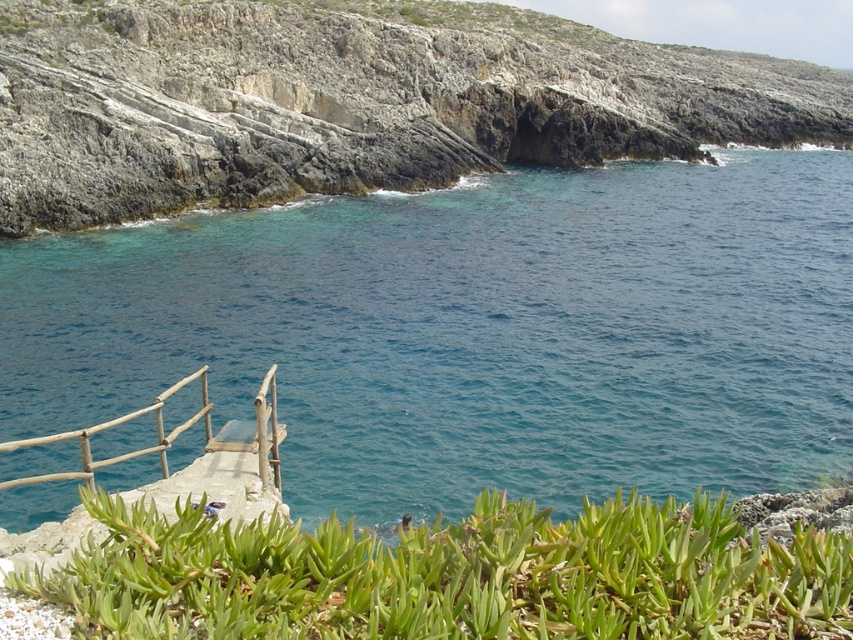
Does point (3, 138) come closer to viewer compared to point (39, 444)?

No, (3, 138) is further to viewer.

Who is positioned more to the right, rugged stone cliff at upper center or wooden rail at lower left?

rugged stone cliff at upper center is more to the right.

The image size is (853, 640). What do you see at coordinates (352, 100) in the screenshot?
I see `rugged stone cliff at upper center` at bounding box center [352, 100].

At what (x,y) coordinates should I click in order to perform the action: click on rugged stone cliff at upper center. Please return your answer as a coordinate pair (x, y). This screenshot has height=640, width=853. Looking at the image, I should click on (352, 100).

Does rugged stone cliff at upper center appear on the left side of green succulent at lower center?

In fact, rugged stone cliff at upper center is to the right of green succulent at lower center.

Between point (556, 54) and point (436, 627), which one is positioned behind?

The point (556, 54) is behind.

Who is more distant from viewer, (202, 68) or (648, 556)?

Point (202, 68)

Locate an element on the screen. rugged stone cliff at upper center is located at coordinates (352, 100).

Can you confirm if blue water at upper center is positioned above green succulent at lower center?

Yes.

Does blue water at upper center appear on the right side of green succulent at lower center?

Yes, blue water at upper center is to the right of green succulent at lower center.

Image resolution: width=853 pixels, height=640 pixels. What do you see at coordinates (474, 332) in the screenshot?
I see `blue water at upper center` at bounding box center [474, 332].

The image size is (853, 640). What are the coordinates of `blue water at upper center` in the screenshot? It's located at (474, 332).